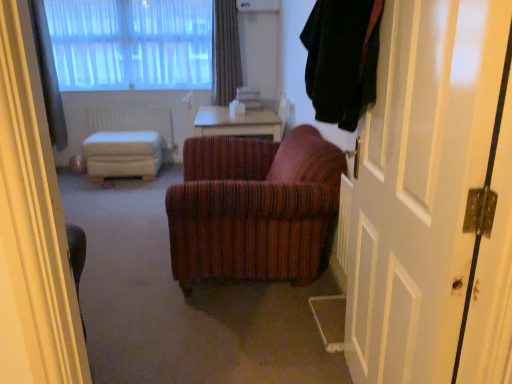
The height and width of the screenshot is (384, 512). What do you see at coordinates (225, 52) in the screenshot?
I see `gray textured curtain at upper center, which is counted as the 2th curtain, starting from the left` at bounding box center [225, 52].

Find the location of a particular element. wooden table at center is located at coordinates (237, 123).

In order to face white wooden door at right, should I rotate leftwards or rightwards?

You should look right and rotate roughly 16.722 degrees.

Find the location of a particular element. This screenshot has width=512, height=384. dark green fuzzy robe at upper right is located at coordinates (342, 59).

This screenshot has width=512, height=384. What do you see at coordinates (131, 44) in the screenshot?
I see `white sheer curtains at upper left` at bounding box center [131, 44].

Locate an element on the screen. white plastic radiator at center is located at coordinates (134, 121).

From the image's perspective, is white plastic radiator at center positioned above or below white wooden stool at center?

white plastic radiator at center is situated higher than white wooden stool at center in the image.

From a real-world perspective, is white plastic radiator at center above or below white wooden stool at center?

white plastic radiator at center is situated higher than white wooden stool at center in the real world.

Considering the sizes of white plastic radiator at center and white wooden stool at center in the image, is white plastic radiator at center bigger or smaller than white wooden stool at center?

Considering their sizes, white plastic radiator at center takes up less space than white wooden stool at center.

In the image, is white sheer curtain at upper left, positioned as the 2th curtain in right-to-left order, positioned in front of or behind gray textured curtain at upper center, which is the first curtain in right-to-left order?

white sheer curtain at upper left, positioned as the 2th curtain in right-to-left order, is positioned closer to the viewer than gray textured curtain at upper center, which is the first curtain in right-to-left order.

Does white sheer curtain at upper left, positioned as the 2th curtain in right-to-left order, touch gray textured curtain at upper center, which is the first curtain in right-to-left order?

white sheer curtain at upper left, positioned as the 2th curtain in right-to-left order, and gray textured curtain at upper center, which is the first curtain in right-to-left order, are clearly separated.

From the image's perspective, is white sheer curtain at upper left, which is the 1th curtain in left-to-right order, located above or below gray textured curtain at upper center, which is the first curtain in right-to-left order?

From the image's perspective, white sheer curtain at upper left, which is the 1th curtain in left-to-right order, appears below gray textured curtain at upper center, which is the first curtain in right-to-left order.

Which is less distant, (46, 113) or (215, 37)?

Point (215, 37)

Does dark green fuzzy robe at upper right have a lesser height compared to white wooden door at right?

Correct, dark green fuzzy robe at upper right is not as tall as white wooden door at right.

Is dark green fuzzy robe at upper right far from white wooden door at right?

No, dark green fuzzy robe at upper right is in close proximity to white wooden door at right.

Do you think dark green fuzzy robe at upper right is within white wooden door at right, or outside of it?

The correct answer is: outside.

Is dark green fuzzy robe at upper right to the left of white wooden door at right from the viewer's perspective?

Indeed, dark green fuzzy robe at upper right is positioned on the left side of white wooden door at right.

Is white sheer curtain at upper left, positioned as the 2th curtain in right-to-left order, placed right next to white wooden stool at center?

No, white sheer curtain at upper left, positioned as the 2th curtain in right-to-left order, is not touching white wooden stool at center.

Could you tell me if white sheer curtain at upper left, which is the 1th curtain in left-to-right order, is turned towards white wooden stool at center?

No, white sheer curtain at upper left, which is the 1th curtain in left-to-right order, does not turn towards white wooden stool at center.

Who is bigger, white sheer curtain at upper left, positioned as the 2th curtain in right-to-left order, or white wooden stool at center?

Bigger between the two is white wooden stool at center.

Can you tell me how much white sheer curtain at upper left, positioned as the 2th curtain in right-to-left order, and white wooden stool at center differ in facing direction?

There is a 3.94-degree angle between the facing directions of white sheer curtain at upper left, positioned as the 2th curtain in right-to-left order, and white wooden stool at center.

Considering the relative sizes of gray textured curtain at upper center, which is the first curtain in right-to-left order, and white sheer curtain at upper left, which is the 1th curtain in left-to-right order, in the image provided, is gray textured curtain at upper center, which is the first curtain in right-to-left order, bigger than white sheer curtain at upper left, which is the 1th curtain in left-to-right order,?

No, gray textured curtain at upper center, which is the first curtain in right-to-left order, is not bigger than white sheer curtain at upper left, which is the 1th curtain in left-to-right order.

From a real-world perspective, relative to white sheer curtain at upper left, which is the 1th curtain in left-to-right order, is gray textured curtain at upper center, which is the first curtain in right-to-left order, vertically above or below?

gray textured curtain at upper center, which is the first curtain in right-to-left order, is situated higher than white sheer curtain at upper left, which is the 1th curtain in left-to-right order, in the real world.

Is gray textured curtain at upper center, which is counted as the 2th curtain, starting from the left, located outside white sheer curtain at upper left, positioned as the 2th curtain in right-to-left order?

Indeed, gray textured curtain at upper center, which is counted as the 2th curtain, starting from the left, is completely outside white sheer curtain at upper left, positioned as the 2th curtain in right-to-left order.

Considering the sizes of white wooden stool at center and wooden table at center in the image, is white wooden stool at center wider or thinner than wooden table at center?

white wooden stool at center is thinner than wooden table at center.

Is white wooden stool at center completely or partially outside of wooden table at center?

Absolutely, white wooden stool at center is external to wooden table at center.

Can you confirm if white wooden stool at center is bigger than wooden table at center?

No, white wooden stool at center is not bigger than wooden table at center.

Is dark green fuzzy robe at upper right directly adjacent to white plastic radiator at center?

dark green fuzzy robe at upper right and white plastic radiator at center are clearly separated.

From a real-world perspective, is dark green fuzzy robe at upper right above or below white plastic radiator at center?

dark green fuzzy robe at upper right is situated higher than white plastic radiator at center in the real world.

Which is more distant, (372, 47) or (165, 111)?

The point (165, 111) is farther from the camera.

Can you confirm if dark green fuzzy robe at upper right is positioned to the right of white plastic radiator at center?

Correct, you'll find dark green fuzzy robe at upper right to the right of white plastic radiator at center.

This screenshot has width=512, height=384. What are the coordinates of `radiator lying behind the white wooden stool at center` in the screenshot? It's located at (134, 121).

In the image, there is a gray textured curtain at upper center, which is counted as the 2th curtain, starting from the left. Where is `curtain below it (from a real-world perspective)`? The image size is (512, 384). curtain below it (from a real-world perspective) is located at coordinates (48, 75).

When comparing their distances from white sheer curtains at upper left, does white wooden door at right or gray textured curtain at upper center, which is counted as the 2th curtain, starting from the left, seem closer?

gray textured curtain at upper center, which is counted as the 2th curtain, starting from the left, is positioned closer to the anchor white sheer curtains at upper left.

Considering their positions, is white sheer curtain at upper left, positioned as the 2th curtain in right-to-left order, positioned further to white sheer curtains at upper left than white wooden stool at center?

white wooden stool at center is positioned further to the anchor white sheer curtains at upper left.

Looking at the image, which one is located further to gray textured curtain at upper center, which is counted as the 2th curtain, starting from the left, white plastic radiator at center or white sheer curtains at upper left?

The object further to gray textured curtain at upper center, which is counted as the 2th curtain, starting from the left, is white plastic radiator at center.

When comparing their distances from white sheer curtain at upper left, which is the 1th curtain in left-to-right order, does white plastic radiator at center or wooden table at center seem further?

The object further to white sheer curtain at upper left, which is the 1th curtain in left-to-right order, is wooden table at center.

Looking at the image, which one is located closer to white wooden stool at center, white sheer curtains at upper left or white wooden door at right?

Based on the image, white sheer curtains at upper left appears to be nearer to white wooden stool at center.

Based on their spatial positions, is gray textured curtain at upper center, which is counted as the 2th curtain, starting from the left, or white plastic radiator at center closer to white sheer curtains at upper left?

white plastic radiator at center.

Estimate the real-world distances between objects in this image. Which object is further from white plastic radiator at center, white sheer curtains at upper left or white sheer curtain at upper left, positioned as the 2th curtain in right-to-left order?

white sheer curtain at upper left, positioned as the 2th curtain in right-to-left order, is further to white plastic radiator at center.

Estimate the real-world distances between objects in this image. Which object is closer to white plastic radiator at center, white wooden door at right or wooden table at center?

wooden table at center is closer to white plastic radiator at center.

Find the location of a particular element. The height and width of the screenshot is (384, 512). stool situated between white plastic radiator at center and wooden table at center from left to right is located at coordinates (123, 154).

Locate an element on the screen. This screenshot has width=512, height=384. table between white wooden door at right and white sheer curtain at upper left, positioned as the 2th curtain in right-to-left order, along the z-axis is located at coordinates (237, 123).

Find the location of a particular element. table between white wooden door at right and gray textured curtain at upper center, which is the first curtain in right-to-left order, from front to back is located at coordinates (237, 123).

Image resolution: width=512 pixels, height=384 pixels. Find the location of `robe positioned between white wooden door at right and white plastic radiator at center from near to far`. robe positioned between white wooden door at right and white plastic radiator at center from near to far is located at coordinates (342, 59).